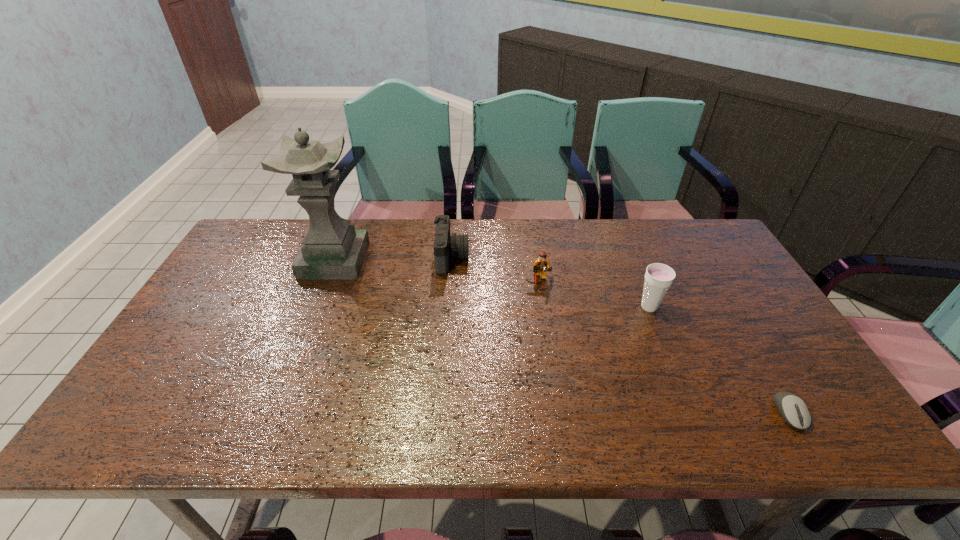
You are a GUI agent. You are given a task and a screenshot of the screen. Output one action in this format:
    pyautogui.click(x=<x>, y=<y>)
    Task: Click on the blank space located on the front of the fourth object from left to right
    The width and height of the screenshot is (960, 540).
    Given the screenshot: What is the action you would take?
    pyautogui.click(x=659, y=330)

Find the location of a particular element. vacant area located at the lens of the fourth object from right to left is located at coordinates (543, 258).

Identify the location of free space located holding a crossbow in the hands of the third object from right to left. (543, 312).

Identify the location of sculpture located at the far edge. (332, 249).

This screenshot has width=960, height=540. Find the location of `camera that is at the far edge`. camera that is at the far edge is located at coordinates (445, 246).

Where is `object positioned at the near edge`? The height and width of the screenshot is (540, 960). object positioned at the near edge is located at coordinates (794, 411).

This screenshot has width=960, height=540. Identify the location of object located in the right edge section of the desktop. (794, 411).

Locate an element on the screen. Image resolution: width=960 pixels, height=540 pixels. object positioned at the near right corner is located at coordinates (794, 411).

This screenshot has height=540, width=960. I want to click on vacant space at the far edge of the desktop, so (x=648, y=255).

This screenshot has height=540, width=960. In order to click on vacant space at the near edge of the desktop in this screenshot , I will do `click(645, 421)`.